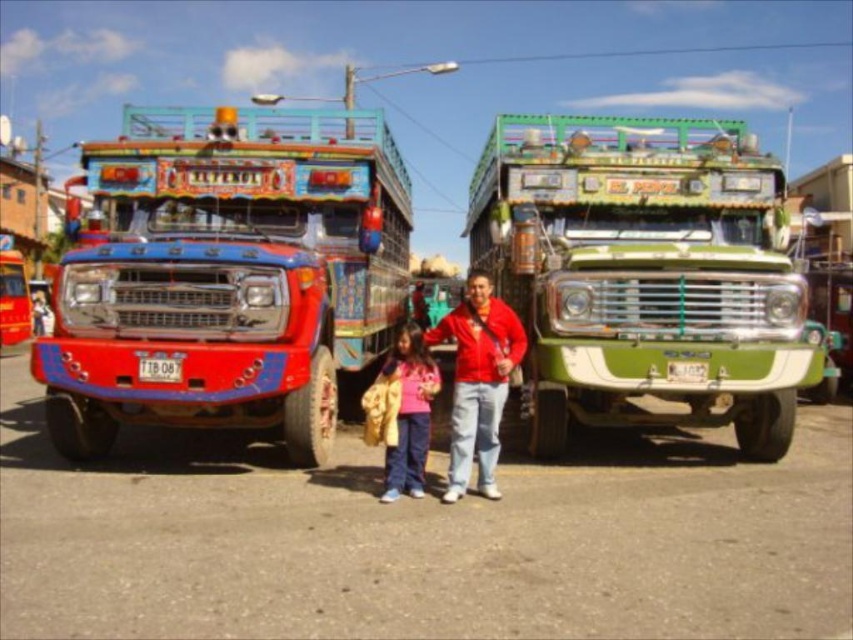
You are standing in front of the two buses and notice two people wearing the red matte jacket at center and the matte pink shirt at center. Which person is closer to you?

The red matte jacket at center is closer to you because the matte pink shirt at center is behind it.

Where is the shiny red truck at left located in the image?

The shiny red truck at left is located at point [225,273] in the image.

You are standing in front of the two decorated buses and notice two points marked in the scene. Which of the two points, point (352, 348) or point (407, 404), is closer to you?

Point (352, 348) is closer to you because it is further to the camera than point (407, 404).